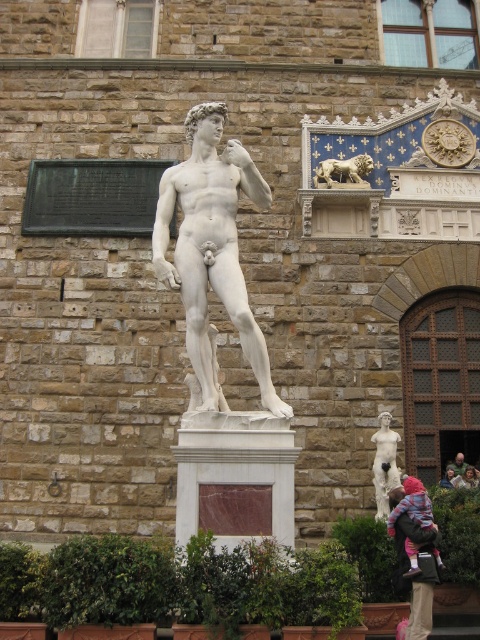
Question: Does white marble statue at center have a lesser width compared to white marble statue at lower right?

Choices:
 (A) yes
 (B) no

Answer: (B)

Question: Among these objects, which one is nearest to the camera?

Choices:
 (A) light brown wood chair at lower right
 (B) gold metallic lion at upper center
 (C) brown hair at lower right

Answer: (C)

Question: Which point is farther from the camera taking this photo?

Choices:
 (A) (349, 179)
 (B) (462, 467)
 (C) (443, 483)
 (D) (477, 472)

Answer: (A)

Question: Which point is closer to the camera?

Choices:
 (A) white marble statue at lower right
 (B) white marble statue at center
 (C) light brown wood chair at lower right

Answer: (B)

Question: Does white marble statue at center have a smaller size compared to light brown wood chair at lower right?

Choices:
 (A) yes
 (B) no

Answer: (B)

Question: Is gold metallic lion at upper center positioned at the back of brown hair at lower right?

Choices:
 (A) yes
 (B) no

Answer: (A)